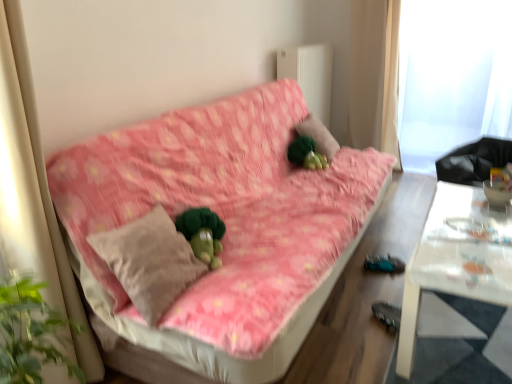
Question: Can you confirm if green plush toy at center is thinner than white fabric curtain at upper right?

Choices:
 (A) yes
 (B) no

Answer: (A)

Question: Is white fabric curtain at upper right a part of green plush toy at center?

Choices:
 (A) yes
 (B) no

Answer: (B)

Question: From the image's perspective, is green plush toy at center under white fabric curtain at upper right?

Choices:
 (A) no
 (B) yes

Answer: (B)

Question: Would you say green plush toy at center is outside white fabric curtain at upper right?

Choices:
 (A) yes
 (B) no

Answer: (A)

Question: Is green plush toy at center smaller than white fabric curtain at upper right?

Choices:
 (A) no
 (B) yes

Answer: (B)

Question: Does green plush toy at center have a greater width compared to white fabric curtain at upper right?

Choices:
 (A) yes
 (B) no

Answer: (B)

Question: From the image's perspective, is green plush toy at center on top of beige fabric pillow at center?

Choices:
 (A) yes
 (B) no

Answer: (A)

Question: Is green plush toy at center wider than beige fabric pillow at center?

Choices:
 (A) no
 (B) yes

Answer: (A)

Question: Does green plush toy at center have a greater height compared to beige fabric pillow at center?

Choices:
 (A) no
 (B) yes

Answer: (A)

Question: Is green plush toy at center not inside beige fabric pillow at center?

Choices:
 (A) yes
 (B) no

Answer: (A)

Question: From a real-world perspective, is green plush toy at center physically below beige fabric pillow at center?

Choices:
 (A) yes
 (B) no

Answer: (A)

Question: Is green plush toy at center far away from beige fabric pillow at center?

Choices:
 (A) yes
 (B) no

Answer: (A)

Question: Is green plush at center to the right of transparent plastic window screen at upper right from the viewer's perspective?

Choices:
 (A) no
 (B) yes

Answer: (A)